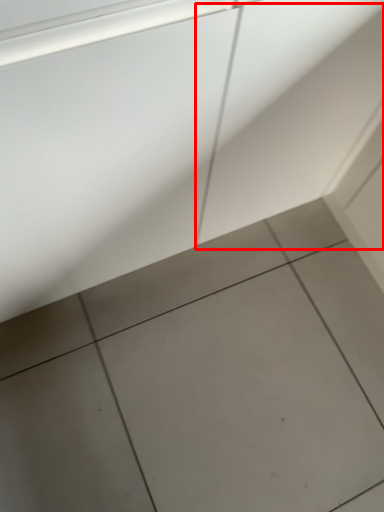
Question: Observing the image, what is the correct spatial positioning of concrete (annotated by the red box) in reference to ceramic tile?

Choices:
 (A) left
 (B) right

Answer: (B)